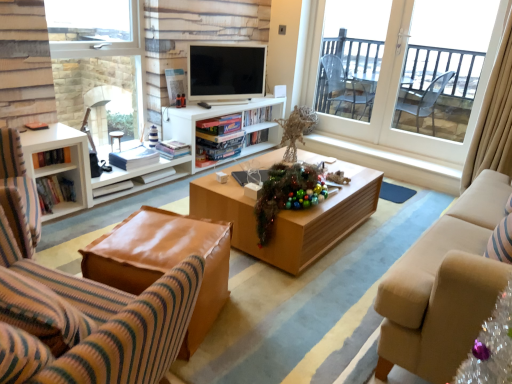
I want to click on blank space to the left of beige fabric curtain at right, so click(x=423, y=201).